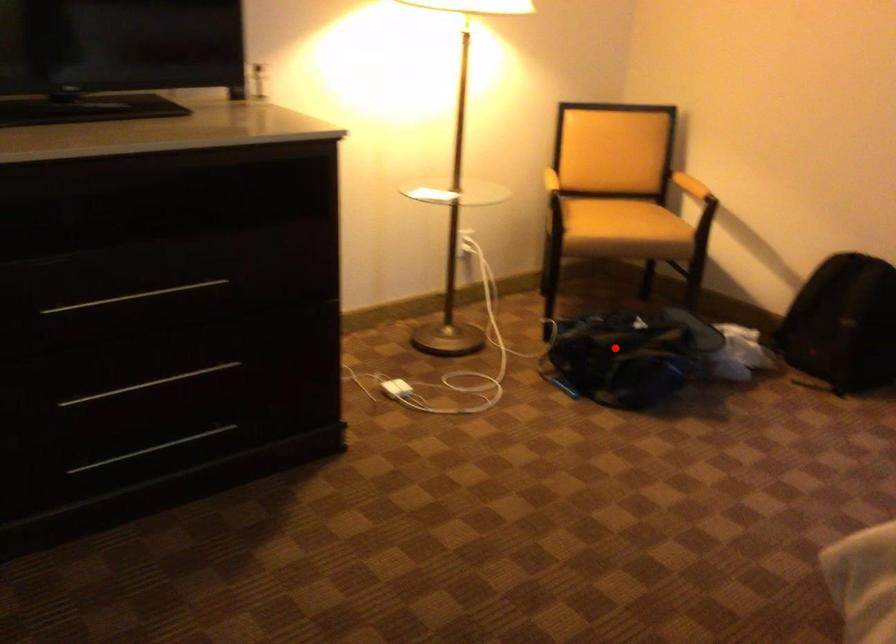
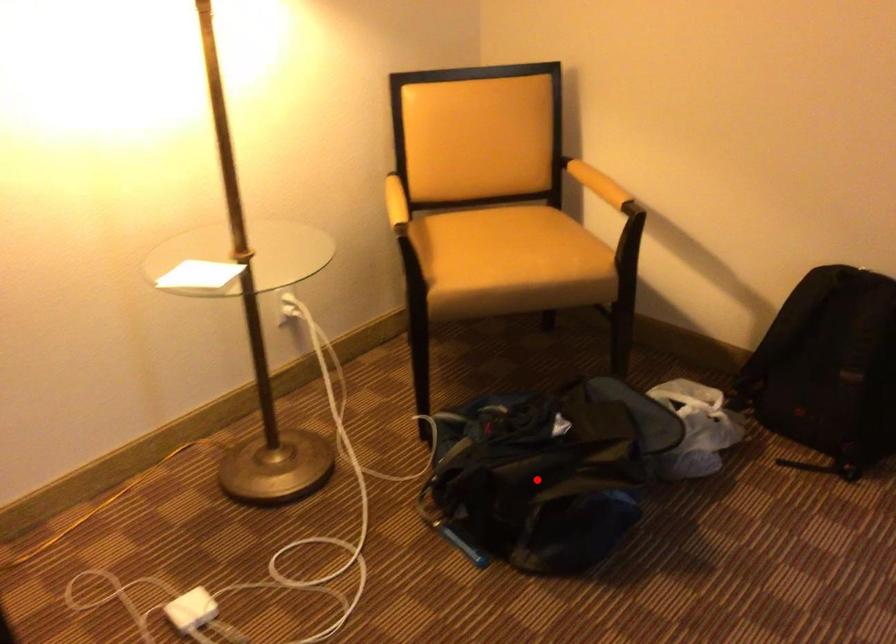
I am providing you with two images of the same scene from different viewpoints. A red point is marked on the first image and another point is marked on the second image. Is the marked point in image1 the same physical position as the marked point in image2?

Yes